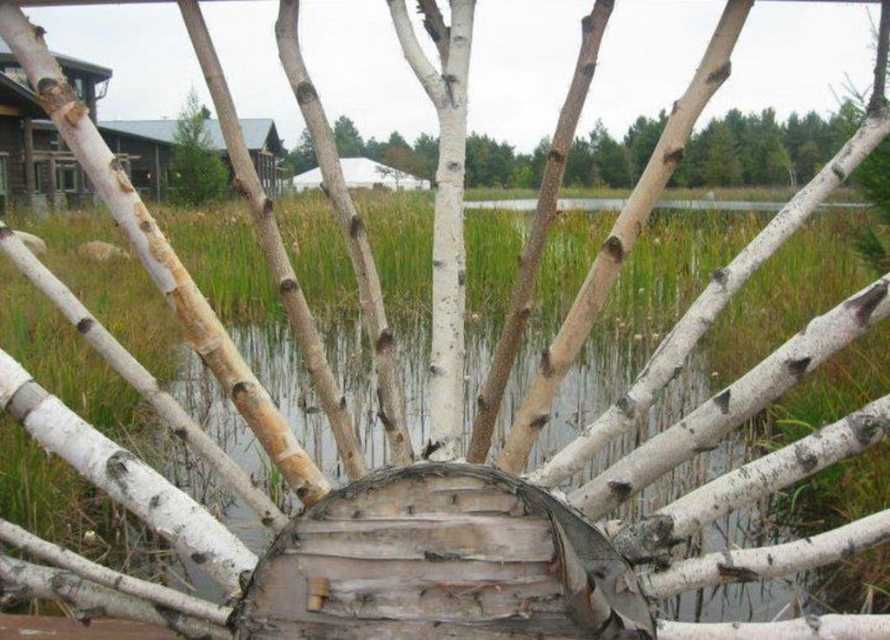
Who is shorter, green grass at center or wooden wagon wheel at center?

With less height is wooden wagon wheel at center.

Does green grass at center appear on the left side of wooden wagon wheel at center?

Indeed, green grass at center is positioned on the left side of wooden wagon wheel at center.

What do you see at coordinates (702, 483) in the screenshot? This screenshot has width=890, height=640. I see `green grass at center` at bounding box center [702, 483].

You are a GUI agent. You are given a task and a screenshot of the screen. Output one action in this format:
    pyautogui.click(x=<x>, y=<y>)
    Task: Click on the green grass at center
    Image resolution: width=890 pixels, height=640 pixels.
    Given the screenshot: What is the action you would take?
    pyautogui.click(x=702, y=483)

Does wooden wagon wheel at center have a larger size compared to green textured pine tree at upper left?

No.

Is wooden wagon wheel at center thinner than green textured pine tree at upper left?

Yes.

The image size is (890, 640). What do you see at coordinates (441, 564) in the screenshot? I see `wooden wagon wheel at center` at bounding box center [441, 564].

In order to click on wooden wagon wheel at center in this screenshot , I will do `click(441, 564)`.

Can you confirm if green grass at center is positioned below wooden cabin at upper left?

Yes.

Between green grass at center and wooden cabin at upper left, which one has more height?

green grass at center is taller.

What do you see at coordinates (702, 483) in the screenshot? I see `green grass at center` at bounding box center [702, 483].

I want to click on green grass at center, so click(702, 483).